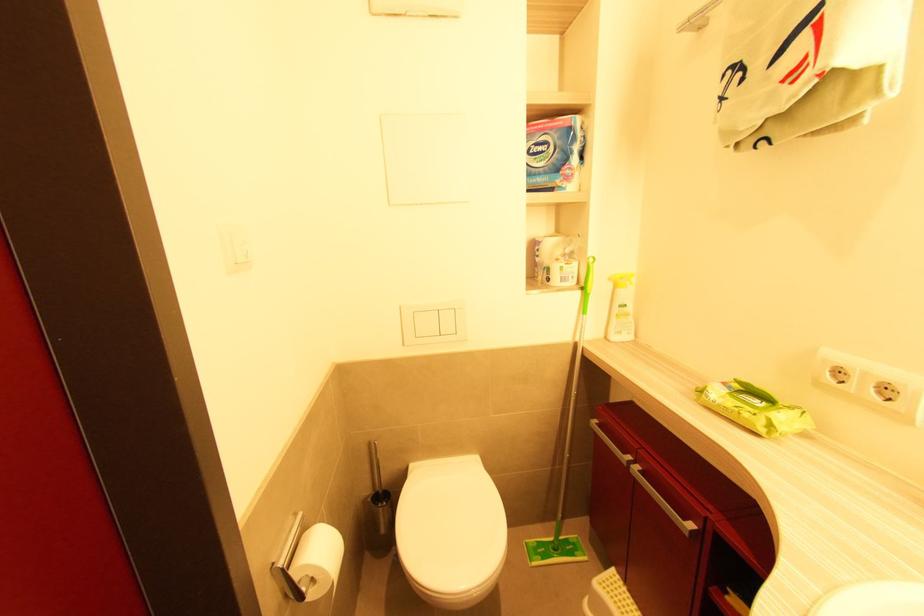
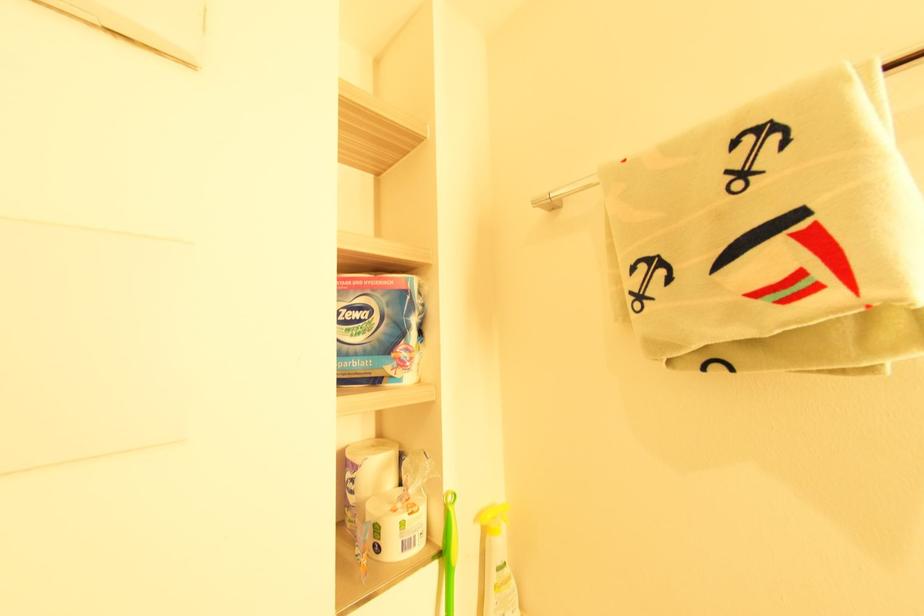
The first image is from the beginning of the video and the second image is from the end. How did the camera likely rotate when shooting the video?

The camera's rotation is toward right-up.